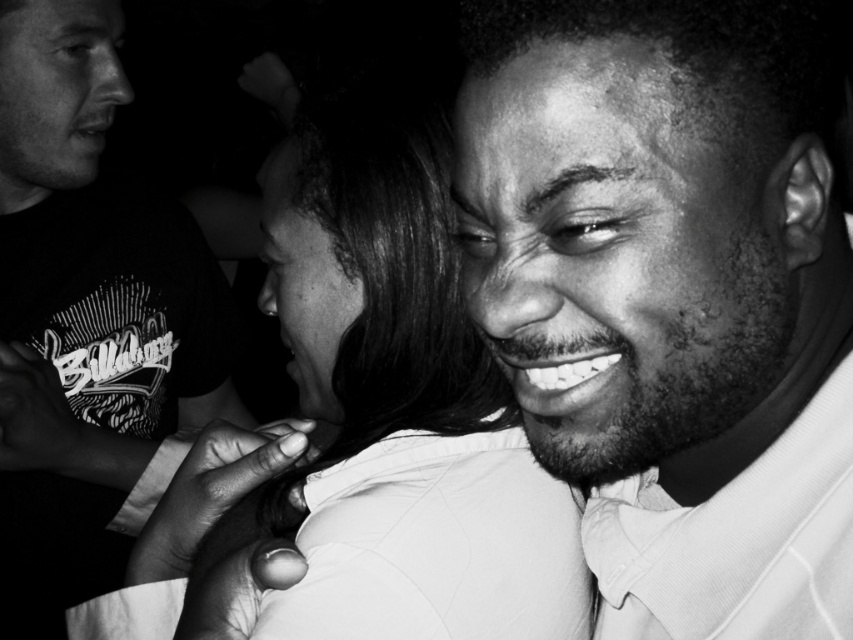
Can you confirm if smooth skin face at center is positioned to the right of smooth skin at center?

Correct, you'll find smooth skin face at center to the right of smooth skin at center.

Is smooth skin face at center thinner than smooth skin at center?

Yes.

At what (x,y) coordinates should I click in order to perform the action: click on smooth skin face at center. Please return your answer as a coordinate pair (x, y). This screenshot has height=640, width=853. Looking at the image, I should click on (671, 296).

Can you confirm if smooth skin face at center is positioned to the left of matte black shirt at upper left?

In fact, smooth skin face at center is to the right of matte black shirt at upper left.

What do you see at coordinates (671, 296) in the screenshot?
I see `smooth skin face at center` at bounding box center [671, 296].

At what (x,y) coordinates should I click in order to perform the action: click on smooth skin face at center. Please return your answer as a coordinate pair (x, y). Looking at the image, I should click on (671, 296).

Does smooth skin at center have a greater height compared to matte black shirt at upper left?

Incorrect, smooth skin at center's height is not larger of matte black shirt at upper left's.

Who is more forward, (299, 541) or (53, 573)?

Point (299, 541) is in front.

Identify the location of smooth skin at center. The height and width of the screenshot is (640, 853). (403, 401).